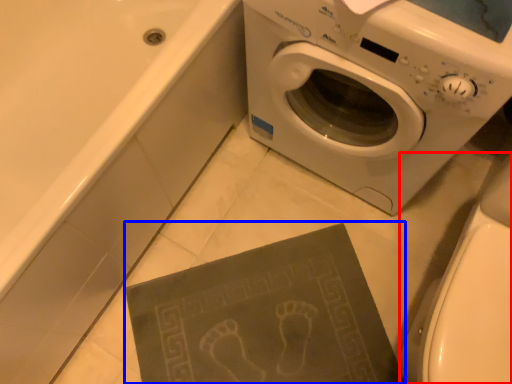
Question: Which point is further to the camera, toilet bowl (highlighted by a red box) or paperback book (highlighted by a blue box)?

Choices:
 (A) toilet bowl
 (B) paperback book

Answer: (B)